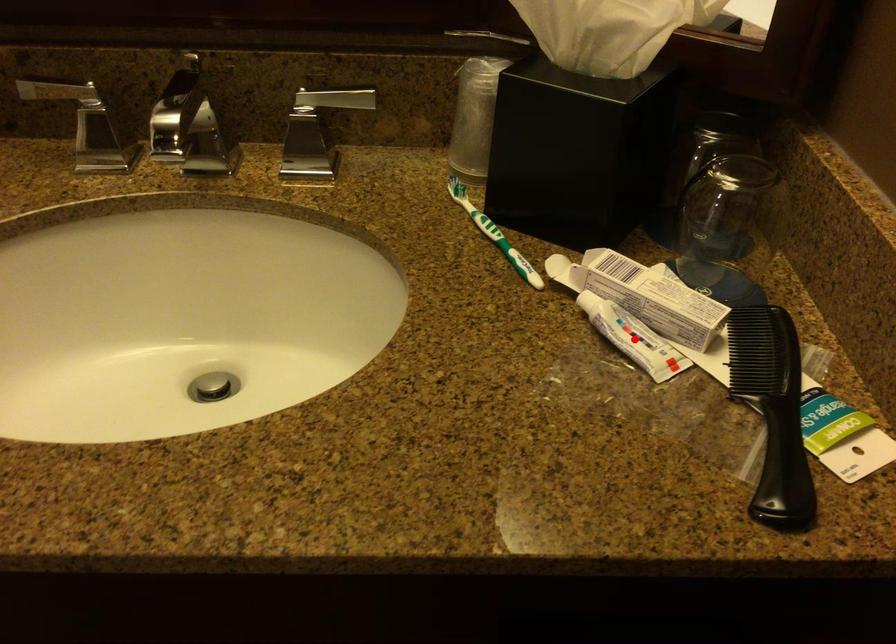
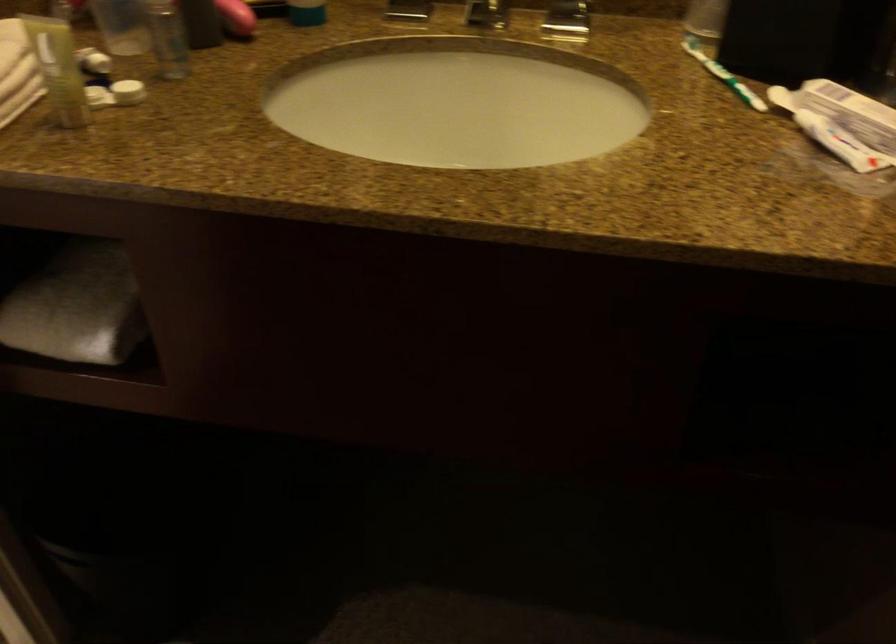
Question: I am providing you with two images of the same scene from different viewpoints. Given a red point in image1, look at the same physical point in image2. Is it:

Choices:
 (A) Closer to the viewpoint
 (B) Farther from the viewpoint

Answer: (B)